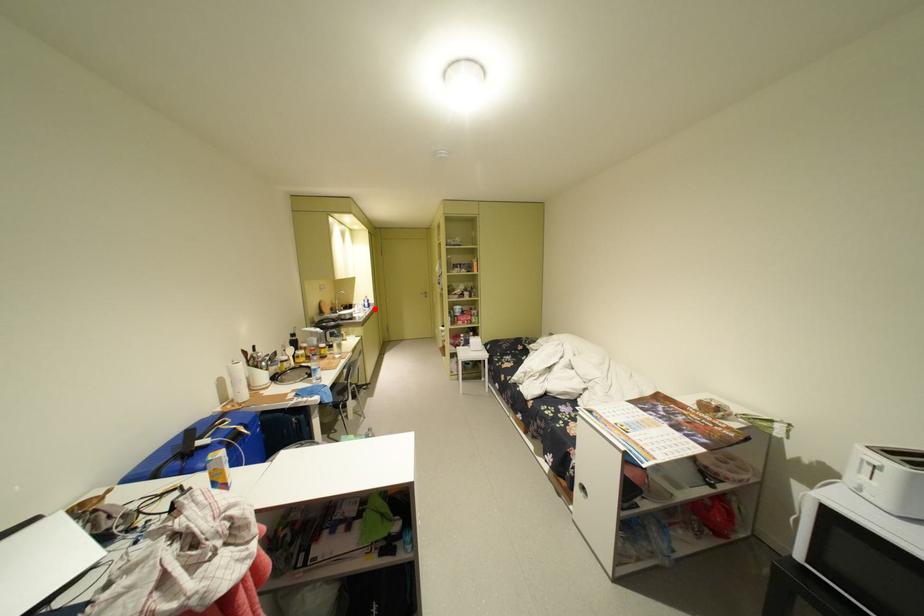
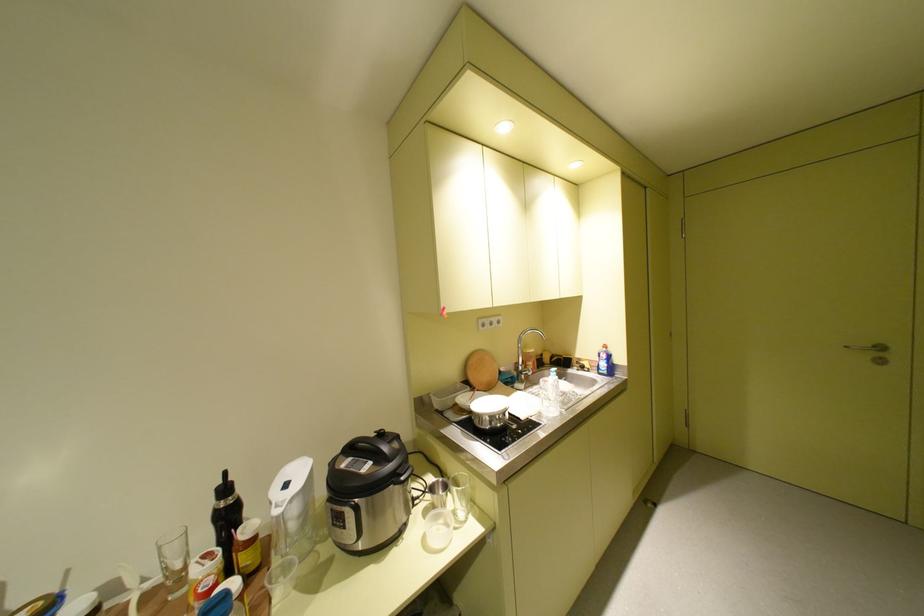
Question: A red point is marked in image1. In image2, is the corresponding 3D point closer to the camera or farther? Reply with the corresponding letter.

Choices:
 (A) The corresponding 3D point is closer.
 (B) The corresponding 3D point is farther.

Answer: (B)